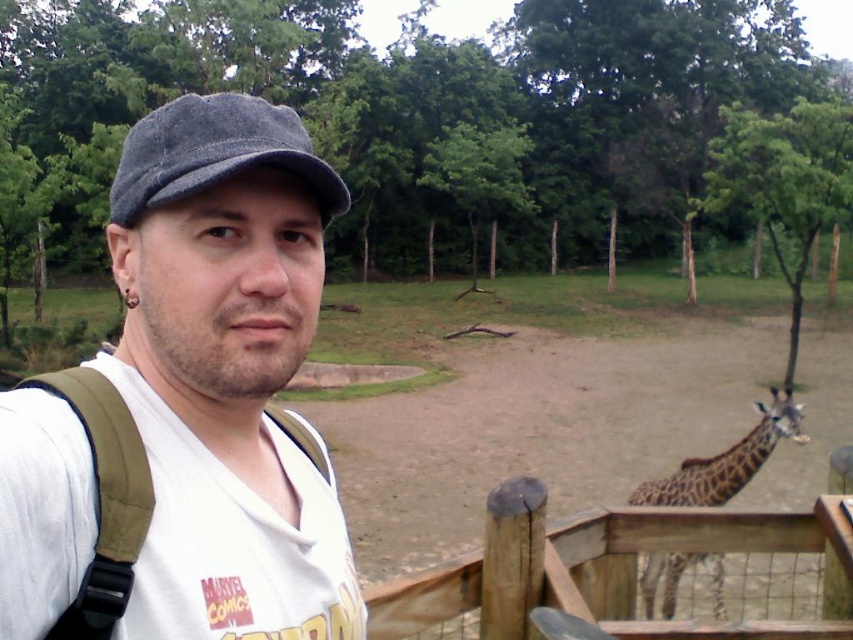
Question: Among these objects, which one is farthest from the camera?

Choices:
 (A) denim cap at center
 (B) white cotton t-shirt at center
 (C) wooden at right

Answer: (C)

Question: Considering the real-world distances, which object is closest to the brown spotted giraffe at lower right?

Choices:
 (A) denim cap at center
 (B) white cotton t-shirt at center
 (C) wooden at right

Answer: (C)

Question: Is white cotton t-shirt at center below wooden at right?

Choices:
 (A) no
 (B) yes

Answer: (A)

Question: Which of the following is the farthest from the observer?

Choices:
 (A) (677, 616)
 (B) (125, 506)
 (C) (221, 120)
 (D) (697, 502)

Answer: (D)

Question: Does wooden at right appear over denim cap at center?

Choices:
 (A) no
 (B) yes

Answer: (A)

Question: Is white cotton t-shirt at center wider than brown spotted giraffe at lower right?

Choices:
 (A) no
 (B) yes

Answer: (A)